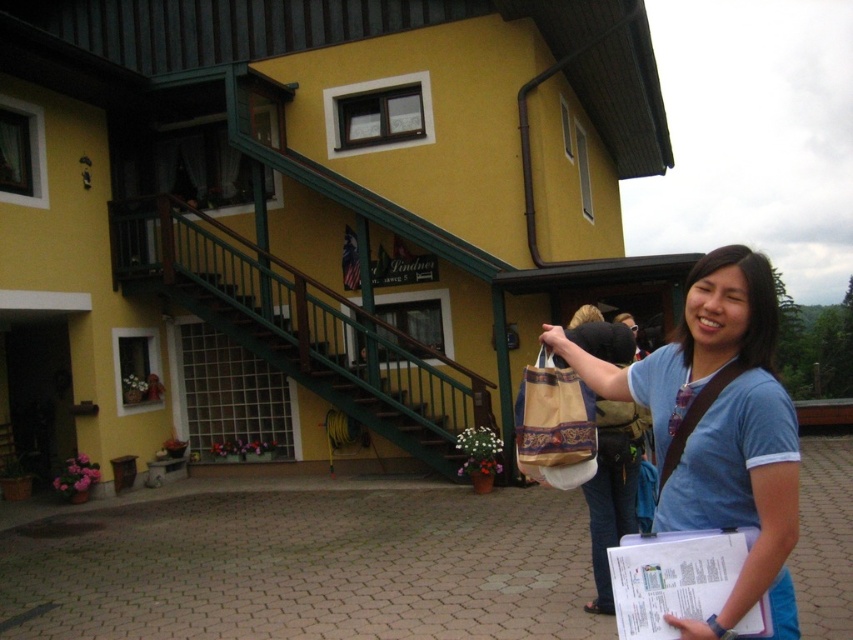
Question: Does matte blue shirt at center have a smaller size compared to brown woven tote bag at center?

Choices:
 (A) yes
 (B) no

Answer: (B)

Question: Can you confirm if matte blue shirt at center is bigger than brown woven tote bag at center?

Choices:
 (A) no
 (B) yes

Answer: (B)

Question: Is matte blue shirt at center to the left of brown woven tote bag at center from the viewer's perspective?

Choices:
 (A) no
 (B) yes

Answer: (A)